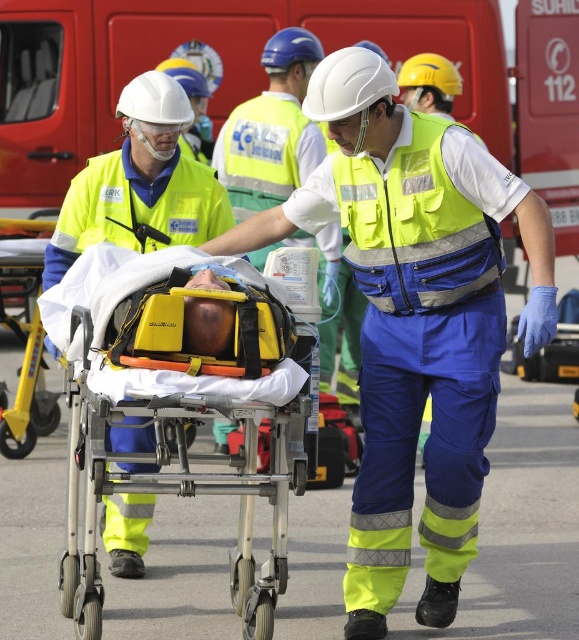
You are a safety inspector checking the emergency team setup. The yellow reflective vest at center and the yellow plastic stretcher at lower left are both in your field of view. Which object is wider?

The yellow reflective vest at center is wider than the yellow plastic stretcher at lower left according to the description.

You are an emergency responder who needs to choose a stretcher for a patient requiring more space. Which stretcher should you pick between the yellow plastic stretcher at center and the yellow plastic stretcher at lower left?

The yellow plastic stretcher at center has a larger size compared to the yellow plastic stretcher at lower left, so you should pick the yellow plastic stretcher at center for the patient requiring more space.